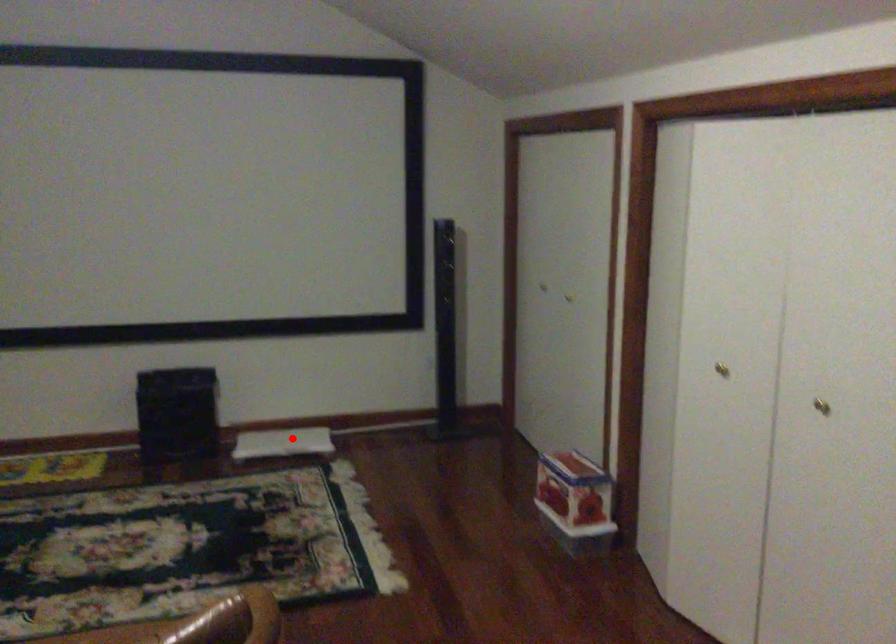
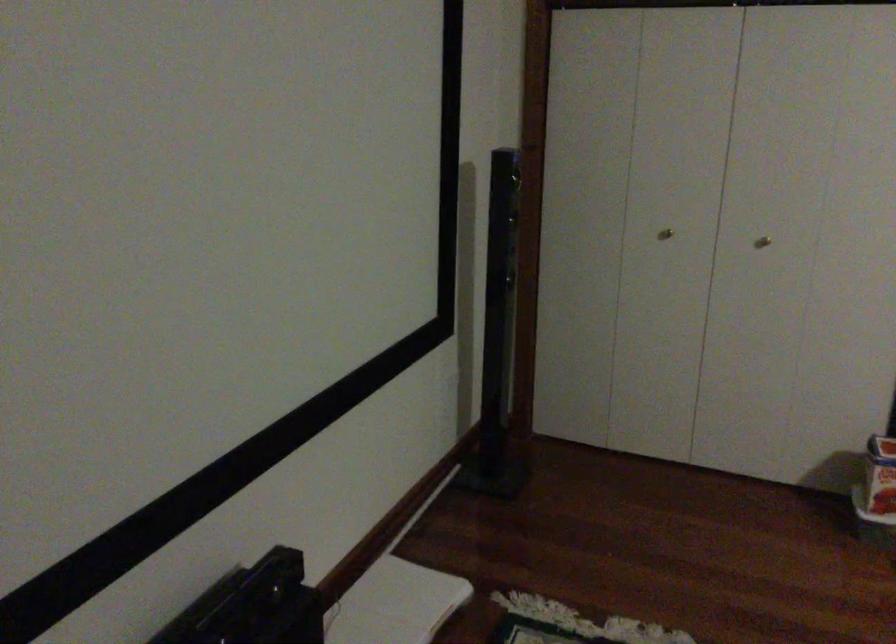
Question: I am providing you with two images of the same scene from different viewpoints. Image1 has a red point marked. In image2, the corresponding 3D location appears at what relative position? Reply with the corresponding letter.

Choices:
 (A) Closer
 (B) Farther

Answer: (A)